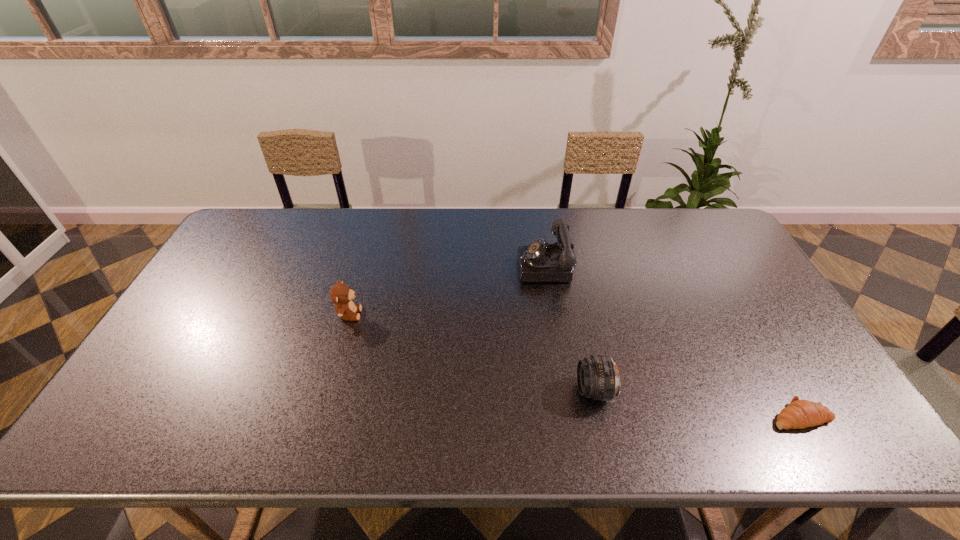
What are the coordinates of `vacant space that satisfies the following two spatial constraints: 1. on the face of the teddy bear; 2. on the back side of the shortest object` in the screenshot? It's located at (320, 416).

Locate an element on the screen. The image size is (960, 540). free space that satisfies the following two spatial constraints: 1. on the face of the leftmost object; 2. on the right side of the crescent roll is located at coordinates (320, 416).

This screenshot has width=960, height=540. What are the coordinates of `vacant area that satisfies the following two spatial constraints: 1. at the front element of the telephoto lens; 2. on the back side of the crescent roll` in the screenshot? It's located at (600, 416).